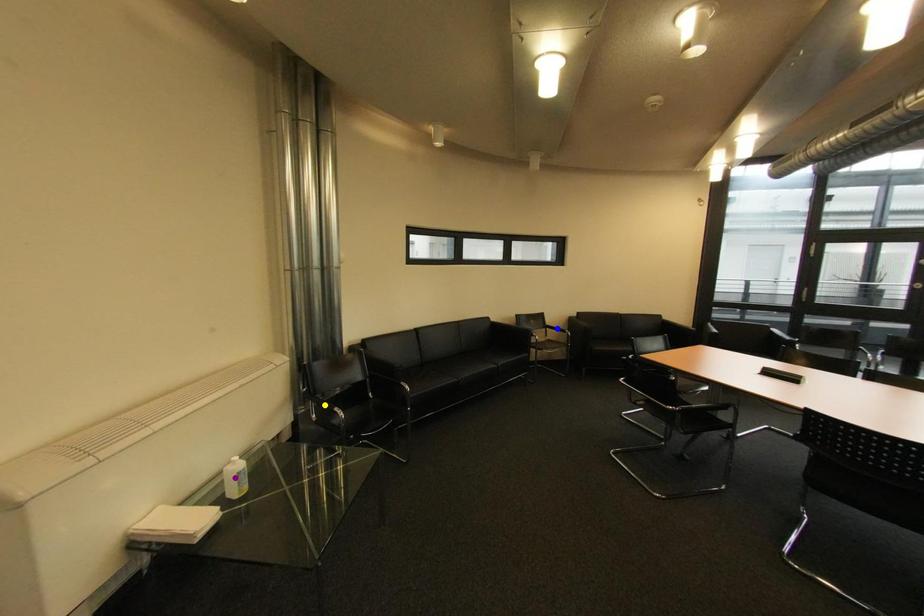
Order these from nearest to farthest:
1. yellow point
2. purple point
3. blue point

purple point < yellow point < blue point